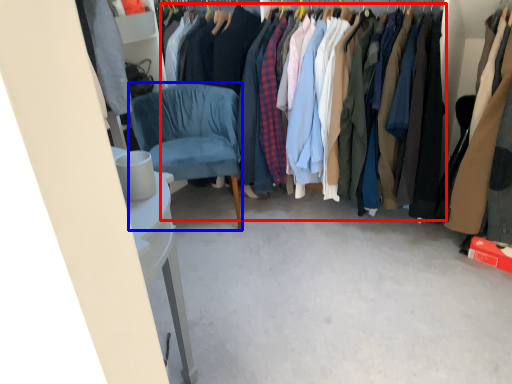
Question: Which object is further to the camera taking this photo, clothing (highlighted by a red box) or chair (highlighted by a blue box)?

Choices:
 (A) clothing
 (B) chair

Answer: (B)